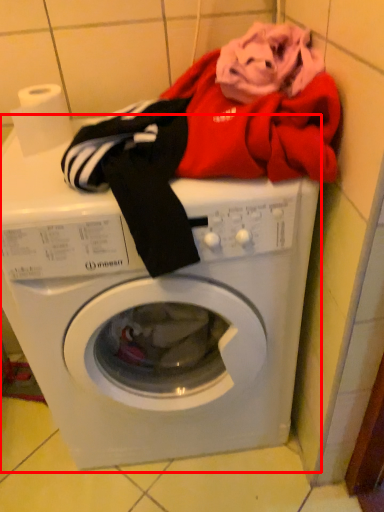
Question: From the image, what is the correct spatial relationship of washing machine (annotated by the red box) in relation to toilet paper?

Choices:
 (A) right
 (B) left

Answer: (A)